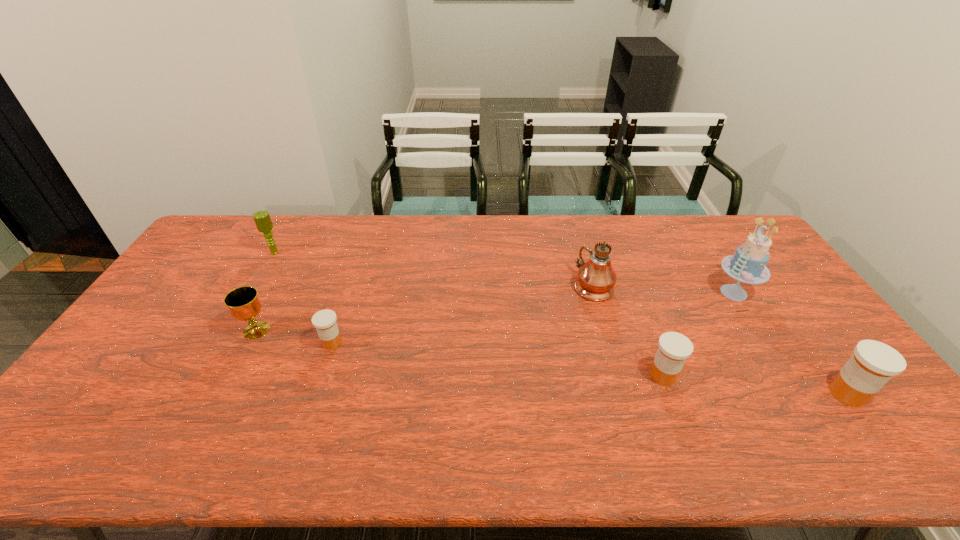
At what (x,y) coordinates should I click in order to perform the action: click on vacant space located with a ladder on the side of the cake. Please return your answer as a coordinate pair (x, y). Looking at the image, I should click on (614, 293).

This screenshot has height=540, width=960. Identify the location of free location located 0.370m on the left of the fourth object from left to right. (459, 286).

You are a GUI agent. You are given a task and a screenshot of the screen. Output one action in this format:
    pyautogui.click(x=<x>, y=<y>)
    Task: Click on the object situated at the far edge
    Image resolution: width=960 pixels, height=540 pixels.
    Given the screenshot: What is the action you would take?
    pyautogui.click(x=262, y=219)

Where is `medicine at the right edge`? medicine at the right edge is located at coordinates (873, 364).

The height and width of the screenshot is (540, 960). I want to click on cake located at the right edge, so click(x=748, y=264).

At what (x,y) coordinates should I click in order to perform the action: click on object that is at the near right corner. Please return your answer as a coordinate pair (x, y). This screenshot has height=540, width=960. Looking at the image, I should click on (873, 364).

Locate an element on the screen. Image resolution: width=960 pixels, height=540 pixels. vacant space at the far edge of the desktop is located at coordinates (x=331, y=247).

Identify the location of vacant space at the near edge. (319, 416).

In the image, there is a desktop. Identify the location of free space at the left edge. (205, 302).

You are a GUI agent. You are given a task and a screenshot of the screen. Output one action in this format:
    pyautogui.click(x=<x>, y=<y>)
    Task: Click on the vacant point at the near right corner
    
    Given the screenshot: What is the action you would take?
    pyautogui.click(x=850, y=409)